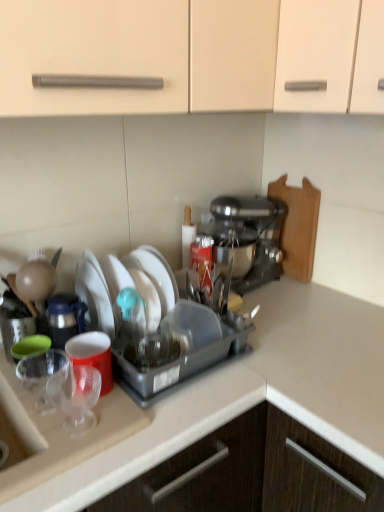
Question: Considering the relative sizes of transparent plastic cup at lower left, the 1th tableware from the bottom, and transparent plastic cups at left in the image provided, is transparent plastic cup at lower left, the 1th tableware from the bottom, bigger than transparent plastic cups at left?

Choices:
 (A) yes
 (B) no

Answer: (B)

Question: Does transparent plastic cup at lower left, which is the second tableware in back-to-front order, have a smaller size compared to transparent plastic cups at left?

Choices:
 (A) no
 (B) yes

Answer: (B)

Question: Is transparent plastic cup at lower left, which is the second tableware in back-to-front order, at the right side of transparent plastic cups at left?

Choices:
 (A) no
 (B) yes

Answer: (B)

Question: Is transparent plastic cup at lower left, which is the second tableware in back-to-front order, shorter than transparent plastic cups at left?

Choices:
 (A) yes
 (B) no

Answer: (A)

Question: Is transparent plastic cup at lower left, which ranks as the 1th tableware in front-to-back order, facing away from transparent plastic cups at left?

Choices:
 (A) yes
 (B) no

Answer: (B)

Question: From a real-world perspective, is transparent plastic cup at lower left, which is the second tableware in back-to-front order, located beneath transparent plastic cups at left?

Choices:
 (A) no
 (B) yes

Answer: (A)

Question: Considering the relative sizes of transparent plastic cup at lower left, which is the second tableware in back-to-front order, and metallic silver stand mixer at center-right in the image provided, is transparent plastic cup at lower left, which is the second tableware in back-to-front order, wider than metallic silver stand mixer at center-right?

Choices:
 (A) yes
 (B) no

Answer: (B)

Question: Is transparent plastic cup at lower left, which ranks as the 1th tableware in front-to-back order, thinner than metallic silver stand mixer at center-right?

Choices:
 (A) no
 (B) yes

Answer: (B)

Question: Is transparent plastic cup at lower left, which ranks as the 1th tableware in front-to-back order, directly adjacent to metallic silver stand mixer at center-right?

Choices:
 (A) yes
 (B) no

Answer: (B)

Question: Is transparent plastic cup at lower left, which is the second tableware in back-to-front order, further to camera compared to metallic silver stand mixer at center-right?

Choices:
 (A) yes
 (B) no

Answer: (B)

Question: Is transparent plastic cup at lower left, placed as the 2th tableware when sorted from top to bottom, facing towards metallic silver stand mixer at center-right?

Choices:
 (A) yes
 (B) no

Answer: (B)

Question: From the image's perspective, does transparent plastic cup at lower left, placed as the 2th tableware when sorted from top to bottom, appear lower than metallic silver stand mixer at center-right?

Choices:
 (A) no
 (B) yes

Answer: (B)

Question: Does wooden cutting board at right have a greater width compared to white matte plate at center, positioned as the 1th tableware in back-to-front order?

Choices:
 (A) no
 (B) yes

Answer: (A)